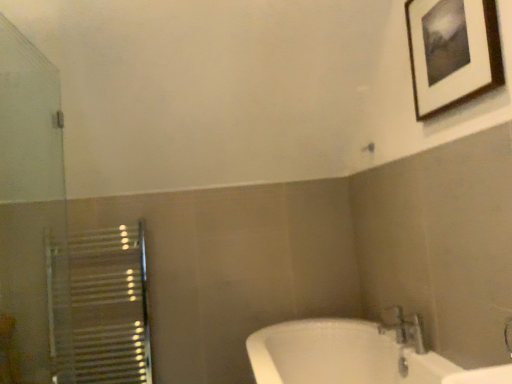
Question: From a real-world perspective, relative to metallic silver faucet at lower right, is transparent glass screen door at left vertically above or below?

Choices:
 (A) above
 (B) below

Answer: (A)

Question: Relative to metallic silver faucet at lower right, is transparent glass screen door at left in front or behind?

Choices:
 (A) front
 (B) behind

Answer: (A)

Question: Considering the real-world distances, which object is farthest from the wooden-framed picture at upper right?

Choices:
 (A) transparent glass screen door at left
 (B) metallic silver faucet at lower right

Answer: (A)

Question: Which of these objects is positioned farthest from the transparent glass screen door at left?

Choices:
 (A) wooden-framed picture at upper right
 (B) metallic silver faucet at lower right

Answer: (B)